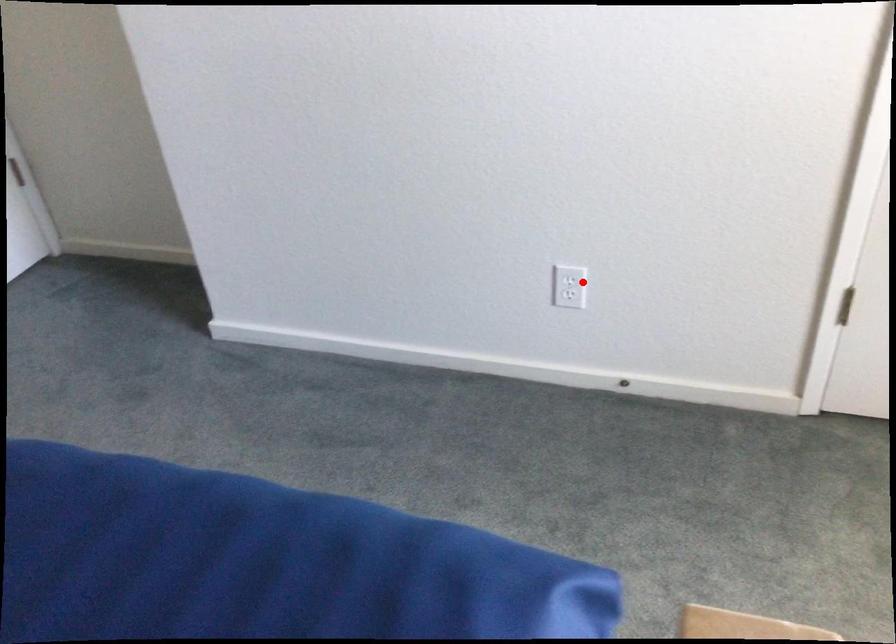
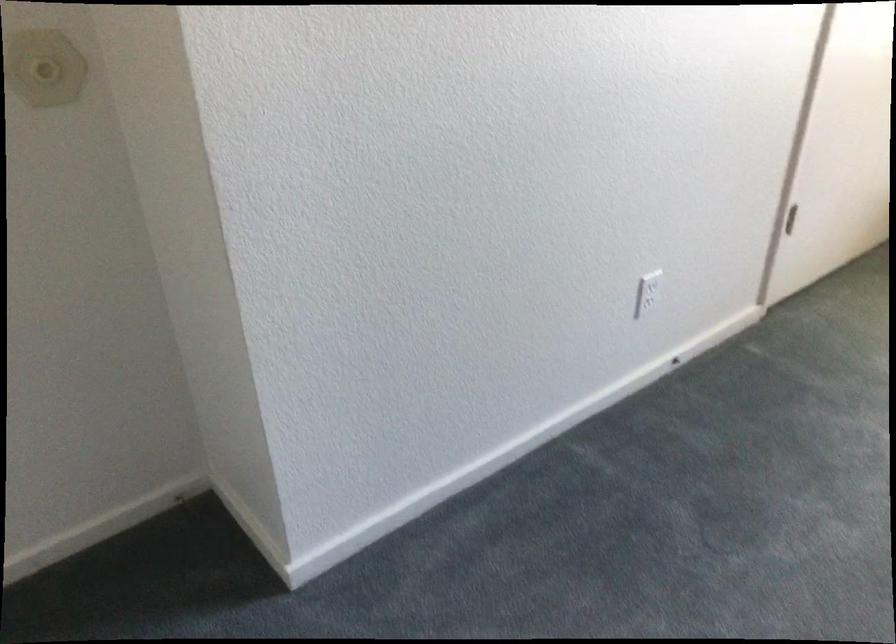
Find the pixel in the second image that matches the highlighted location in the first image.

(650, 285)